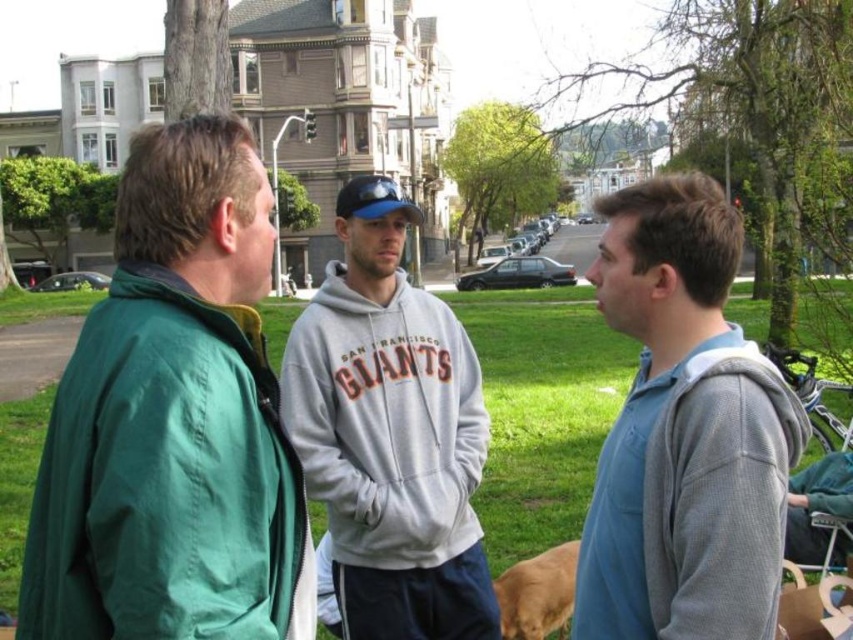
You are a photographer trying to capture a photo of the gray fleece sweatshirt at center and the golden fur dog at lower center. Which object should you focus on first if you want to ensure both are in clear focus, considering their sizes?

The gray fleece sweatshirt at center is taller than the golden fur dog at lower center, so you should focus on the gray fleece sweatshirt at center first to ensure both are in clear focus.

You are a photographer standing at the edge of the park, aiming to capture a photo of the two gray fleece items mentioned in the scene. Given that your camera has a maximum focus range of 12 meters, will you be able to take a clear photo of both the gray fleece jacket at center and the gray fleece sweatshirt at center simultaneously?

The gray fleece jacket at center is 14.35 meters away from the gray fleece sweatshirt at center. Since the camera can only focus up to 12 meters, the distance between them exceeds the maximum focus range. Therefore, you cannot capture both items clearly in a single photo.